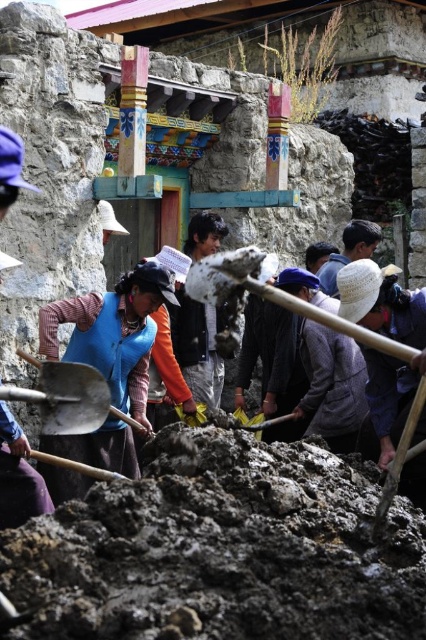
Measure the distance between point (x=215, y=301) and camera.

The distance of point (x=215, y=301) from camera is 39.83 meters.

Is point (244, 288) more distant than point (143, 432)?

No, it is not.

The width and height of the screenshot is (426, 640). I want to click on smooth wooden shovel at center, so click(x=265, y=296).

Looking at this image, does matte metal shovel at lower center appear on the left side of metallic silver shovel at center?

Incorrect, matte metal shovel at lower center is not on the left side of metallic silver shovel at center.

Can you confirm if matte metal shovel at lower center is taller than metallic silver shovel at center?

Correct, matte metal shovel at lower center is much taller as metallic silver shovel at center.

Between point (414, 396) and point (114, 406), which one is positioned behind?

Positioned behind is point (114, 406).

Find the location of a particular element. The image size is (426, 640). matte metal shovel at lower center is located at coordinates tap(399, 458).

Is point (186, 513) closer to viewer compared to point (23, 356)?

Yes, point (186, 513) is in front of point (23, 356).

This screenshot has width=426, height=640. What do you see at coordinates (222, 548) in the screenshot?
I see `dark brown clay at center` at bounding box center [222, 548].

Which is behind, point (221, 632) or point (117, 417)?

The point (117, 417) is behind.

I want to click on dark brown clay at center, so click(x=222, y=548).